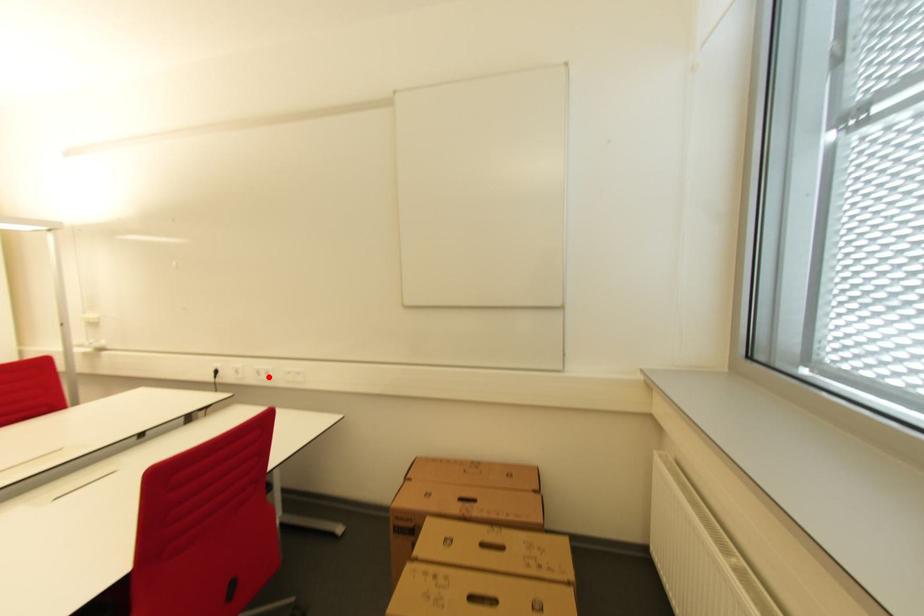
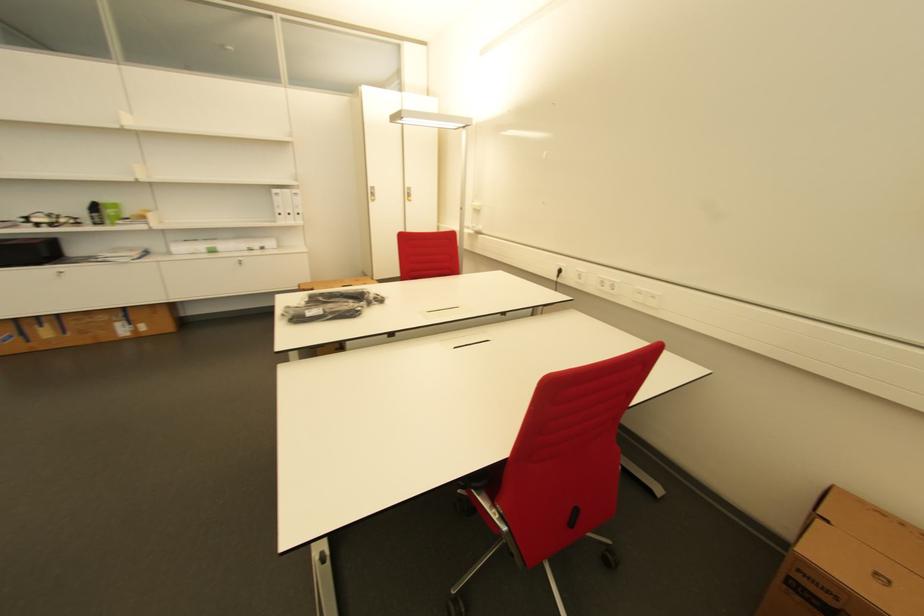
Where in the second image is the point corresponding to the highlighted location from the first image?

(612, 289)